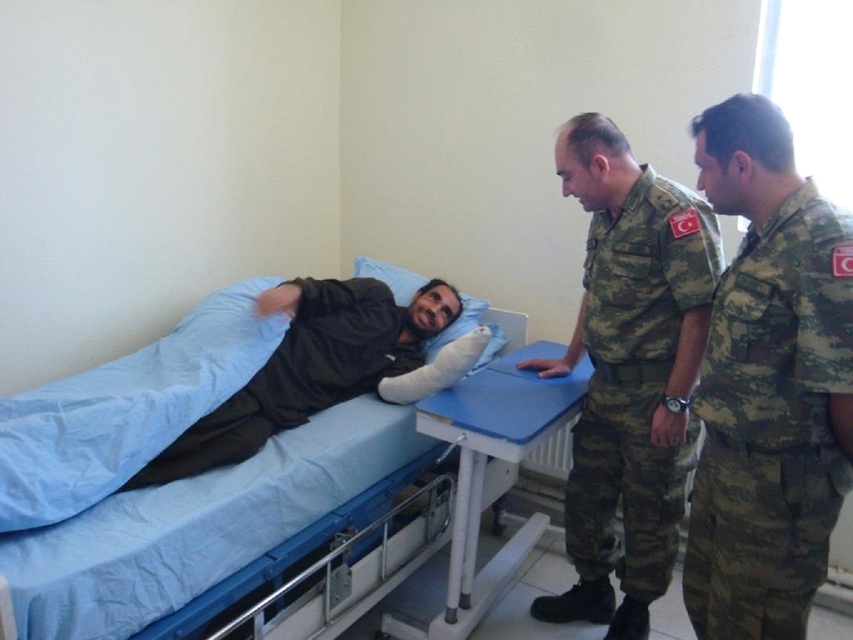
Question: Which of these objects is positioned farthest from the camouflage uniform at center?

Choices:
 (A) white plastic table at center
 (B) camouflage fabric uniform at center

Answer: (B)

Question: Which is nearer to the camouflage uniform at center?

Choices:
 (A) blue fabric pillow at upper center
 (B) camouflage fabric uniform at center
 (C) white plastic table at center

Answer: (C)

Question: Does camouflage fabric uniform at right appear over camouflage fabric uniform at center?

Choices:
 (A) no
 (B) yes

Answer: (A)

Question: From the image, what is the correct spatial relationship of white plastic table at center in relation to blue fabric pillow at upper center?

Choices:
 (A) below
 (B) above

Answer: (A)

Question: Which point is farther to the camera?

Choices:
 (A) tap(428, 358)
 (B) tap(454, 538)

Answer: (A)

Question: Can you confirm if blue fabric bed at center is positioned to the left of blue fabric pillow at upper center?

Choices:
 (A) no
 (B) yes

Answer: (B)